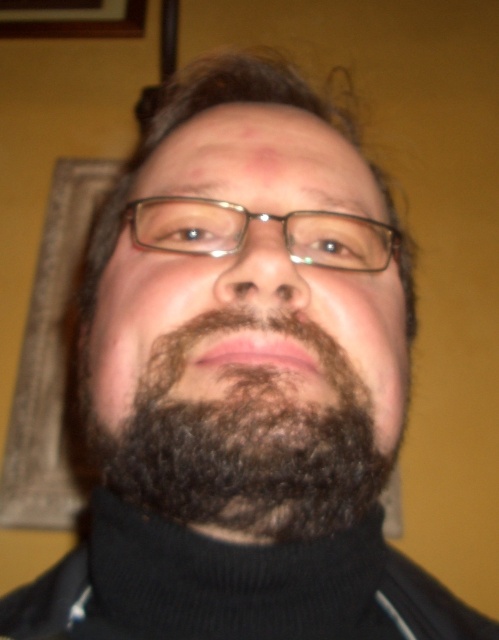
Question: Is the position of dark brown curly beard at center more distant than that of clear plastic glasses at center?

Choices:
 (A) no
 (B) yes

Answer: (A)

Question: Is dark brown curly beard at center bigger than clear plastic glasses at center?

Choices:
 (A) no
 (B) yes

Answer: (B)

Question: Which point is farther to the camera?

Choices:
 (A) black knitted polo neck at center
 (B) dark brown curly beard at center

Answer: (A)

Question: Does black knitted polo neck at center appear on the left side of clear plastic glasses at center?

Choices:
 (A) yes
 (B) no

Answer: (A)

Question: Which point appears farthest from the camera in this image?

Choices:
 (A) (321, 556)
 (B) (205, 236)

Answer: (B)

Question: Which of the following is the farthest from the observer?

Choices:
 (A) clear plastic glasses at center
 (B) black knitted polo neck at center

Answer: (A)